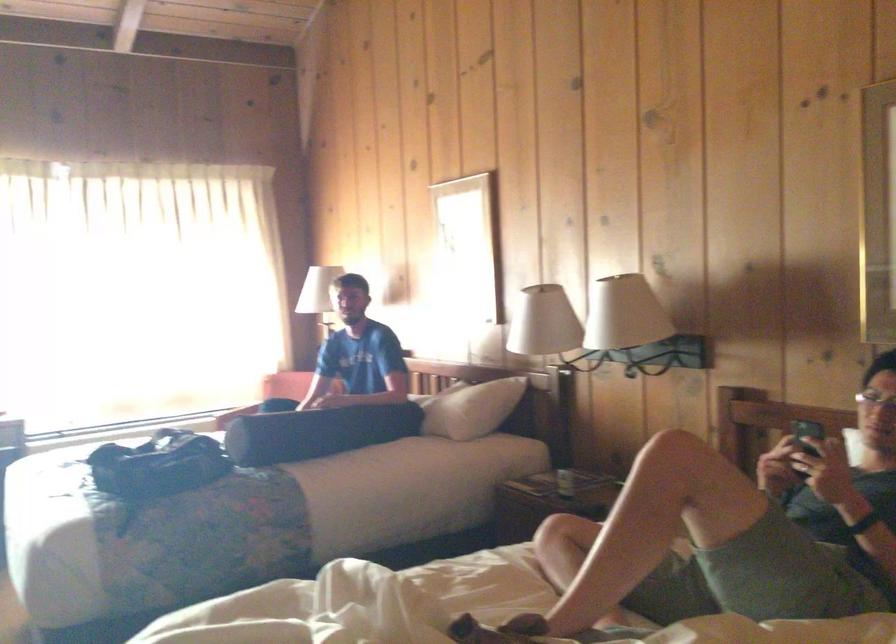
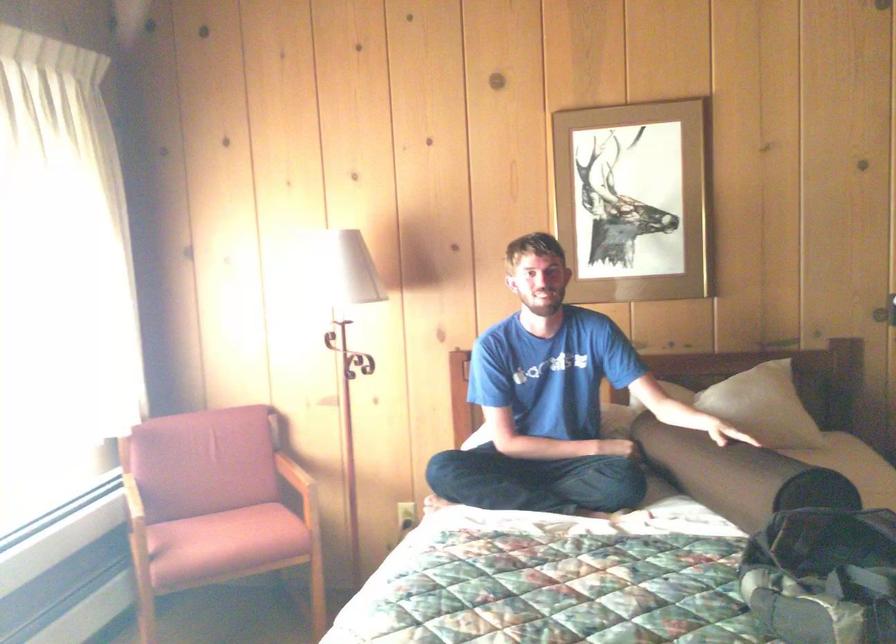
Find the pixel in the second image that matches (426,402) in the first image.

(762, 406)